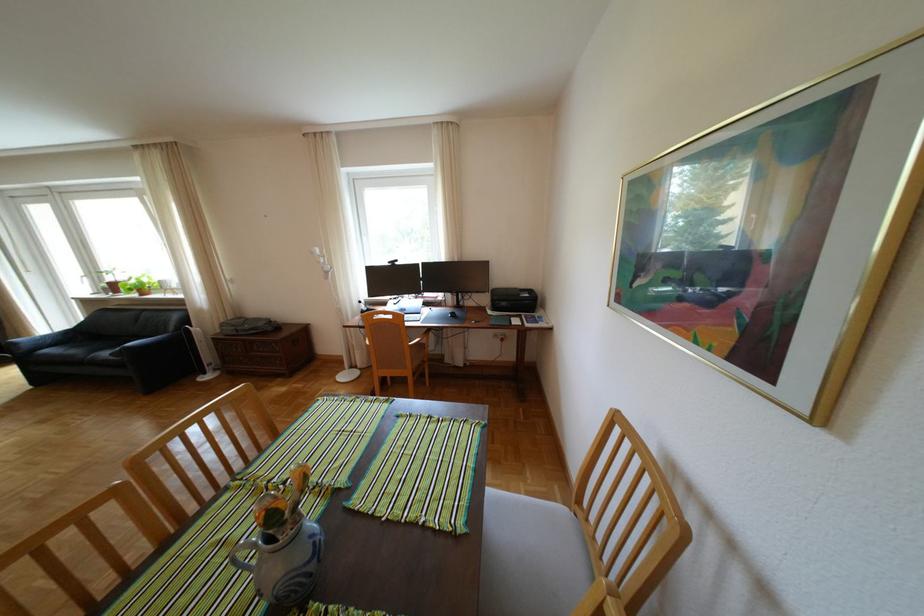
Find the location of a particular element. grey chair sitting surface is located at coordinates (530, 557).